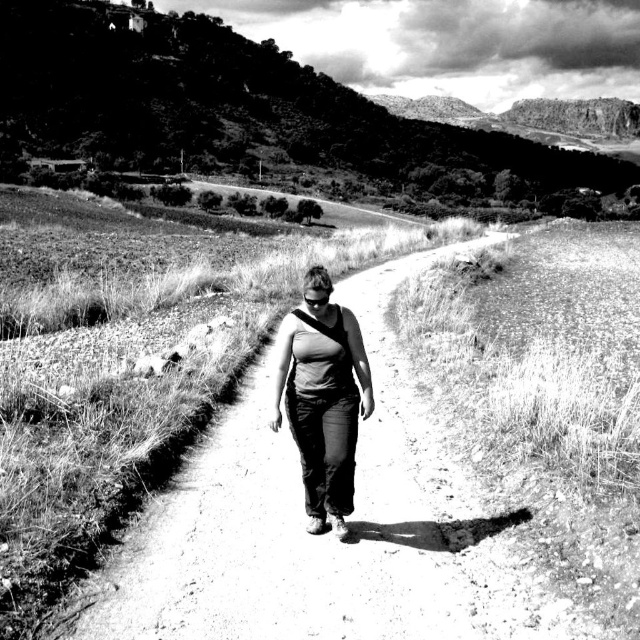
Consider the image. Based on the scene, can you determine which object occupies more horizontal space in the image? Please mention both the grassy hillside at upper center and the dark gray fabric tank top at center in your answer.

The grassy hillside at upper center occupies more horizontal space than the dark gray fabric tank top at center because its width is larger according to the description.

You are a photographer trying to capture the grassy hillside at upper center and the dark gray fabric tank top at center in a single shot. Based on their positions, which object will appear closer to the camera in the photo?

The dark gray fabric tank top at center will appear closer to the camera because it is positioned closer to the viewer than the grassy hillside at upper center, which is further away.